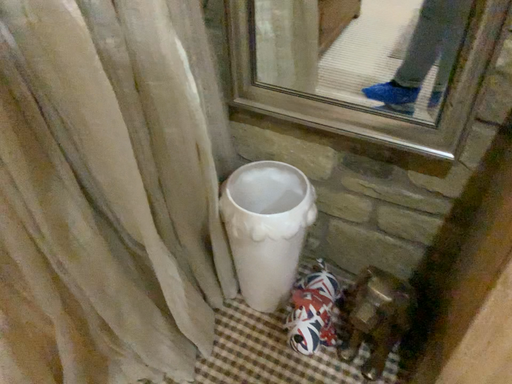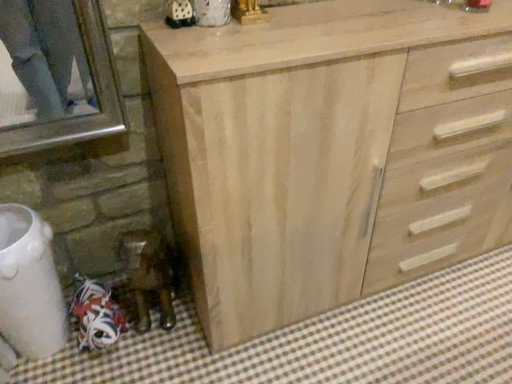
Question: Which way did the camera rotate in the video?

Choices:
 (A) rotated right
 (B) rotated left

Answer: (A)